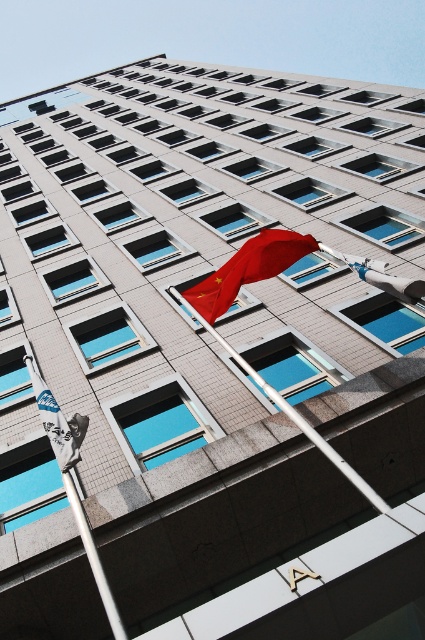
Question: Is white metallic flag pole at center wider than blue fabric flag at lower left?

Choices:
 (A) yes
 (B) no

Answer: (B)

Question: Observing the image, what is the correct spatial positioning of silver metallic flag pole at left in reference to blue fabric flag at lower left?

Choices:
 (A) below
 (B) above

Answer: (A)

Question: Can you confirm if silver metallic flag pole at left is bigger than matte red flag at center?

Choices:
 (A) yes
 (B) no

Answer: (A)

Question: Which of the following is the farthest from the observer?

Choices:
 (A) red fabric flag at center
 (B) silver metallic flag pole at left
 (C) matte red flag at center

Answer: (A)

Question: Which point is farther to the camera?

Choices:
 (A) blue fabric flag at lower left
 (B) white metallic flag pole at center
 (C) red fabric flag at center

Answer: (C)

Question: Which point is farther to the camera?

Choices:
 (A) red fabric flag at center
 (B) white metallic flag pole at center

Answer: (A)